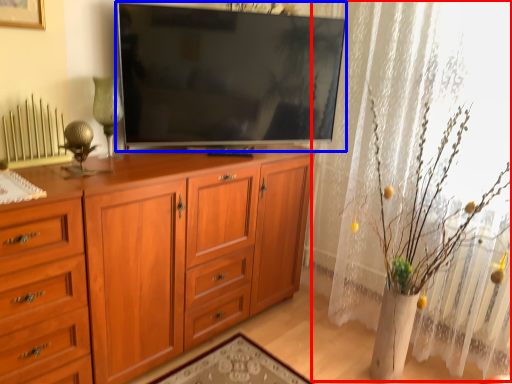
Question: Among these objects, which one is farthest to the camera, curtain (highlighted by a red box) or television (highlighted by a blue box)?

Choices:
 (A) curtain
 (B) television

Answer: (B)